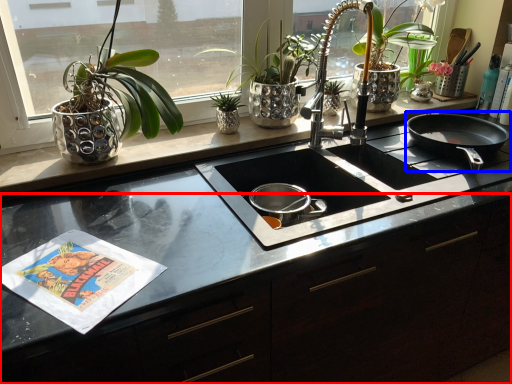
Question: Among these objects, which one is nearest to the camera, counter (highlighted by a red box) or frying pan (highlighted by a blue box)?

Choices:
 (A) counter
 (B) frying pan

Answer: (A)